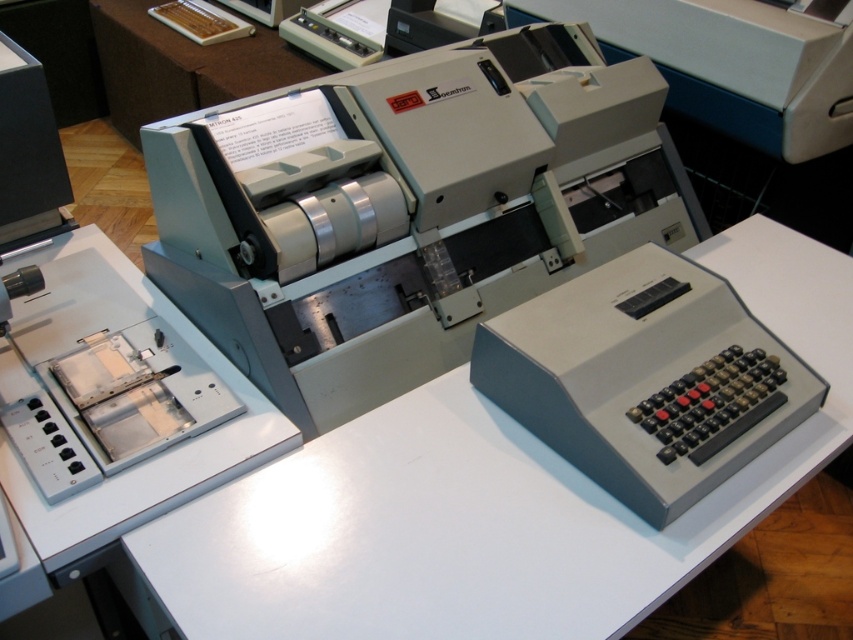
In the scene shown: You are organizing a workspace and need to place a new document collator. The white matte table at center is where you want to place it. Is there enough space on the table for the machine?

The white matte table at center is located at point (488, 502), but without knowing the dimensions of the table or the machine, it is impossible to determine if there is enough space. Please provide more information about the table size or the machine dimensions.

You need to place both the satin gray printer at center and the gray plastic calculator at lower right onto a desk that can only accommodate items up to the size of the calculator. Which item will not fit?

The satin gray printer at center is larger in size than the gray plastic calculator at lower right, so it will not fit on the desk.